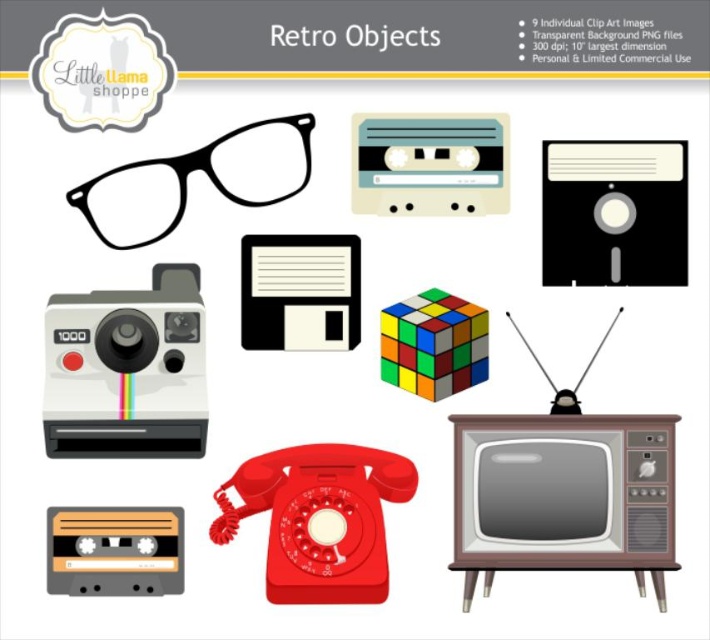
Is beige matte cassette at center to the right of black matte floppy disk at upper center from the viewer's perspective?

Indeed, beige matte cassette at center is positioned on the right side of black matte floppy disk at upper center.

Can you confirm if beige matte cassette at center is positioned above black matte floppy disk at upper center?

Correct, beige matte cassette at center is located above black matte floppy disk at upper center.

You are a GUI agent. You are given a task and a screenshot of the screen. Output one action in this format:
    pyautogui.click(x=<x>, y=<y>)
    Task: Click on the beige matte cassette at center
    
    Given the screenshot: What is the action you would take?
    pyautogui.click(x=430, y=164)

Where is `beige matte cassette at center`? beige matte cassette at center is located at coordinates (430, 164).

Is black matte glasses at upper left above beige matte cassette at center?

No, black matte glasses at upper left is not above beige matte cassette at center.

Is black matte glasses at upper left wider than beige matte cassette at center?

Correct, the width of black matte glasses at upper left exceeds that of beige matte cassette at center.

Does point (158, 204) lie in front of point (496, 144)?

Yes, it is.

In order to click on black matte glasses at upper left in this screenshot , I will do `click(202, 172)`.

Describe the element at coordinates (202, 172) in the screenshot. I see `black matte glasses at upper left` at that location.

Which is more to the left, black matte glasses at upper left or black matte floppy disk at upper center?

black matte glasses at upper left is more to the left.

What do you see at coordinates (202, 172) in the screenshot? I see `black matte glasses at upper left` at bounding box center [202, 172].

Locate an element on the screen. black matte glasses at upper left is located at coordinates (202, 172).